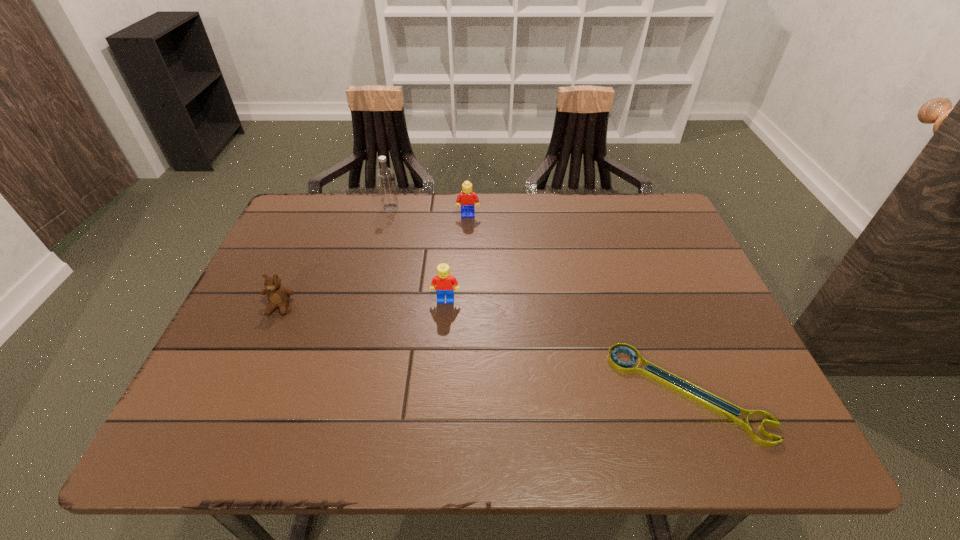
Image resolution: width=960 pixels, height=540 pixels. I want to click on the farthest object, so click(x=385, y=177).

You are a GUI agent. You are given a task and a screenshot of the screen. Output one action in this format:
    pyautogui.click(x=<x>, y=<y>)
    Task: Click on the vodka
    This screenshot has height=540, width=960.
    Given the screenshot: What is the action you would take?
    pyautogui.click(x=385, y=177)

Identify the location of the farther Lego. (467, 198).

I want to click on the nearer Lego, so click(x=446, y=284).

Find the location of a particular element. Image resolution: width=960 pixels, height=540 pixels. the second shortest object is located at coordinates (278, 296).

The width and height of the screenshot is (960, 540). Identify the location of teddy bear. (278, 296).

What are the coordinates of `the nearest object` in the screenshot? It's located at (720, 406).

Where is `the shortest object`? the shortest object is located at coordinates (720, 406).

Where is `free space located 0.370m on the front label of the second object from left to right`? free space located 0.370m on the front label of the second object from left to right is located at coordinates (520, 208).

Where is `vacant space situated 0.370m on the front-facing side of the farther Lego`? The image size is (960, 540). vacant space situated 0.370m on the front-facing side of the farther Lego is located at coordinates (465, 312).